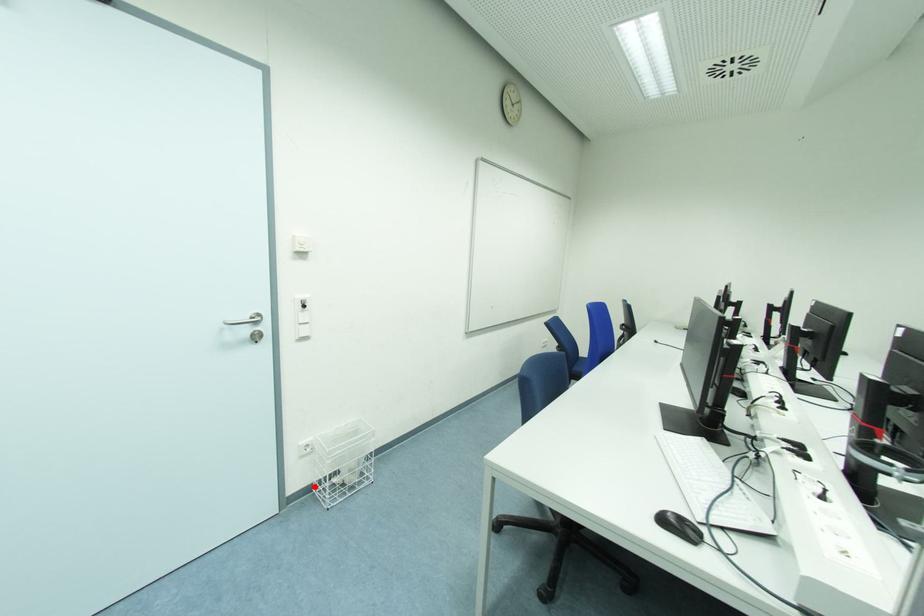
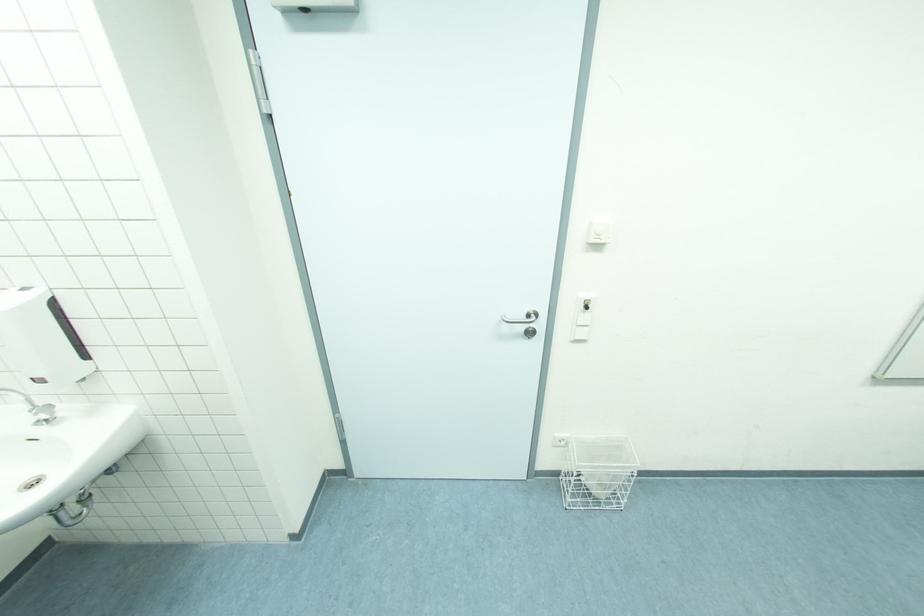
In the second image, find the point that corresponds to the highlighted location in the first image.

(563, 472)